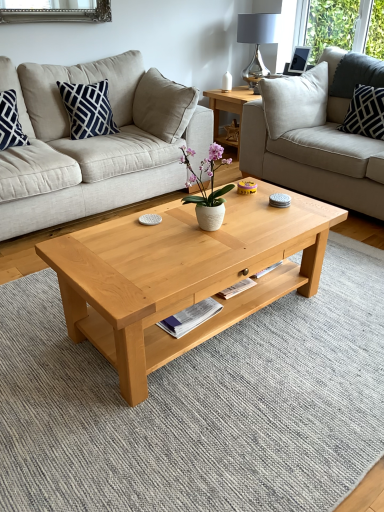
This screenshot has height=512, width=384. I want to click on free location to the right of white ceramic vase at center, so click(x=249, y=230).